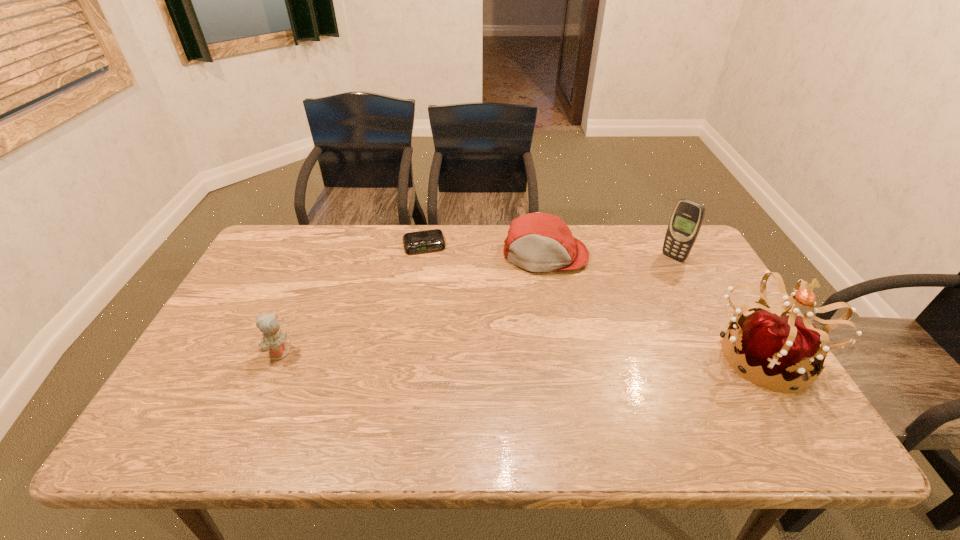
Locate an element on the screen. The image size is (960, 540). cap located in the far edge section of the desktop is located at coordinates (538, 242).

Image resolution: width=960 pixels, height=540 pixels. In order to click on object situated at the near edge in this screenshot , I will do `click(786, 346)`.

Image resolution: width=960 pixels, height=540 pixels. Find the location of `tiara at the right edge`. tiara at the right edge is located at coordinates (786, 346).

This screenshot has width=960, height=540. Find the location of `cellular telephone that is at the right edge`. cellular telephone that is at the right edge is located at coordinates (688, 215).

The width and height of the screenshot is (960, 540). Find the location of `object that is at the far right corner`. object that is at the far right corner is located at coordinates click(688, 215).

Find the location of a particular element. The image size is (960, 540). object that is positioned at the near right corner is located at coordinates (786, 346).

Locate an element on the screen. This screenshot has width=960, height=540. vacant position at the far edge of the desktop is located at coordinates (621, 264).

Find the location of `free space at the near edge of the desktop`. free space at the near edge of the desktop is located at coordinates (368, 407).

Image resolution: width=960 pixels, height=540 pixels. Identify the location of free space at the left edge. pos(211,334).

In the image, there is a desktop. Identify the location of blank space at the right edge. Image resolution: width=960 pixels, height=540 pixels. (689, 299).